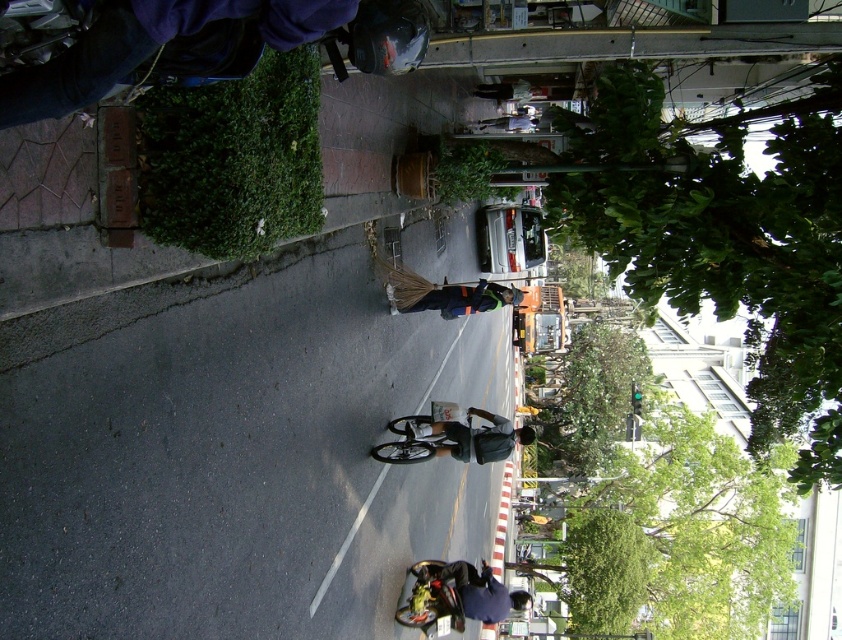
Question: Does dark gray fabric jacket at center appear on the left side of metallic silver bicycle at lower center?

Choices:
 (A) yes
 (B) no

Answer: (B)

Question: Does metallic silver bicycle at lower center appear on the right side of dark blue uniform at center?

Choices:
 (A) no
 (B) yes

Answer: (A)

Question: Can you confirm if dark blue fabric at lower center is wider than dark blue uniform at center?

Choices:
 (A) yes
 (B) no

Answer: (A)

Question: Which is nearer to the dark gray fabric jacket at center?

Choices:
 (A) metallic silver bicycle at lower center
 (B) dark blue fabric at lower center

Answer: (A)

Question: Which point is farther from the camera taking this photo?

Choices:
 (A) (429, 598)
 (B) (462, 285)
 (C) (409, 570)
 (D) (457, 440)

Answer: (C)

Question: Among these objects, which one is farthest from the camera?

Choices:
 (A) dark gray fabric jacket at center
 (B) dark blue fabric at lower center

Answer: (B)